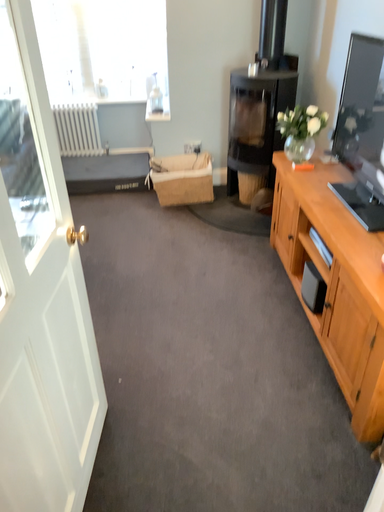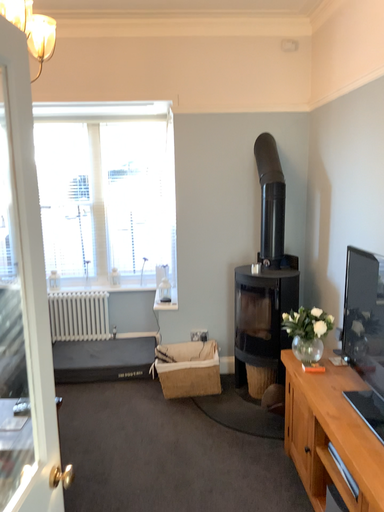
Question: How did the camera likely rotate when shooting the video?

Choices:
 (A) rotated downward
 (B) rotated upward

Answer: (B)